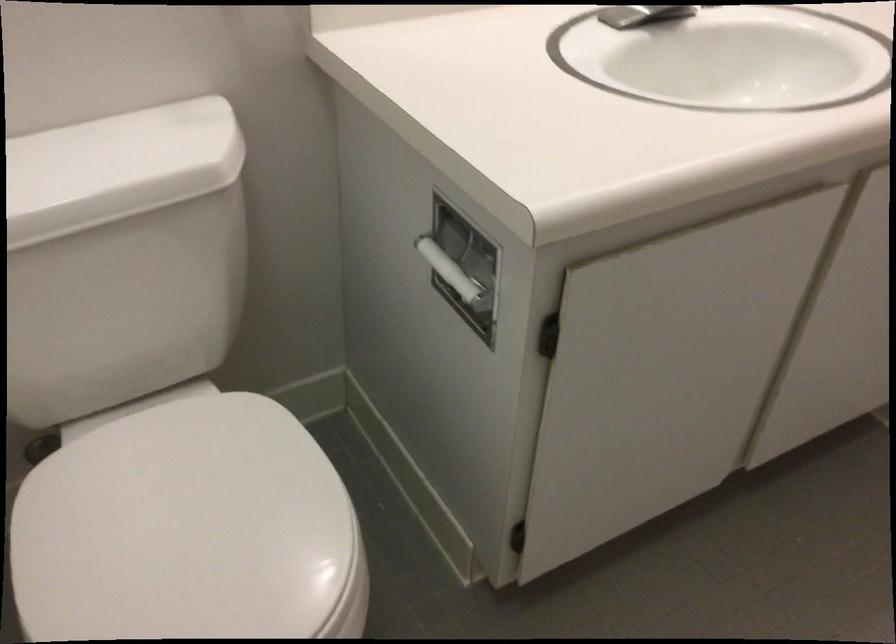
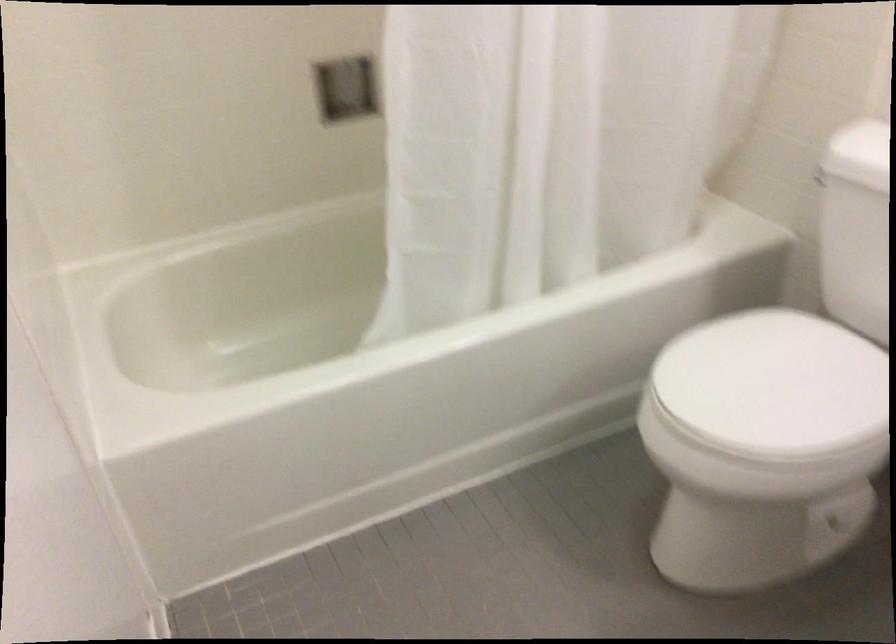
Locate, in the second image, the point that corresponds to [229,526] in the first image.

(773, 384)